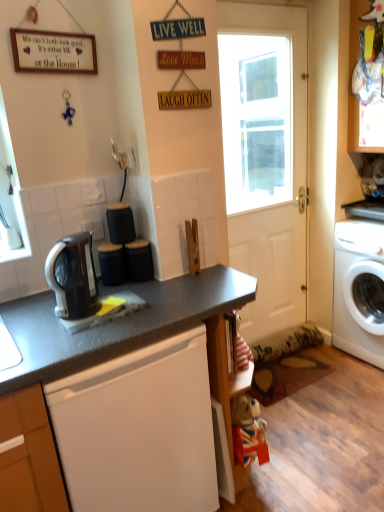
Question: From a real-world perspective, is matte black coffee maker at center, which is counted as the second appliance, starting from the right, above or below white matte door at center?

Choices:
 (A) above
 (B) below

Answer: (B)

Question: In terms of height, does matte black coffee maker at center, the 1th appliance positioned from the left, look taller or shorter compared to white matte door at center?

Choices:
 (A) tall
 (B) short

Answer: (B)

Question: Considering the real-world distances, which object is closest to the black fabric ottoman at center, the 2th appliance from the left?

Choices:
 (A) black glossy coffee maker at left
 (B) white glossy washing machine at right
 (C) matte black countertop at center
 (D) matte black coffee maker at center, which is counted as the second appliance, starting from the right
 (E) white matte door at center

Answer: (D)

Question: Which object is positioned closest to the white glossy washing machine at right?

Choices:
 (A) matte black countertop at center
 (B) black glossy coffee maker at left
 (C) white matte door at center
 (D) black fabric ottoman at center, which is the 1th appliance in right-to-left order
 (E) matte black coffee maker at center, which is counted as the second appliance, starting from the right

Answer: (A)